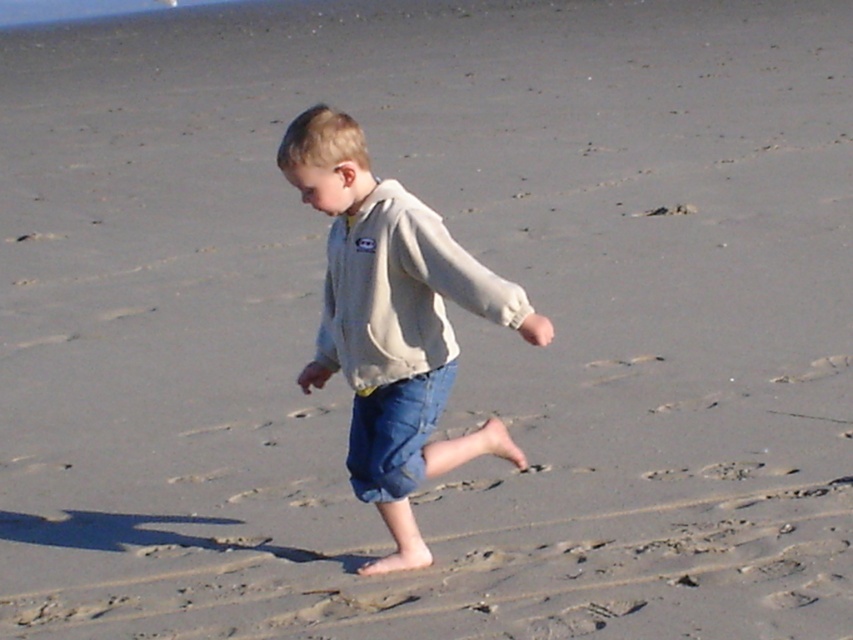
Question: Which point is farther from the camera taking this photo?

Choices:
 (A) (370, 317)
 (B) (292, 170)

Answer: (A)

Question: Which of the following is the closest to the observer?

Choices:
 (A) beige fleece sweatshirt at center
 (B) light beige fleece jacket at center

Answer: (B)

Question: Does light beige fleece jacket at center have a greater width compared to beige fleece sweatshirt at center?

Choices:
 (A) yes
 (B) no

Answer: (A)

Question: Is light beige fleece jacket at center positioned before beige fleece sweatshirt at center?

Choices:
 (A) yes
 (B) no

Answer: (A)

Question: Is light beige fleece jacket at center positioned at the back of beige fleece sweatshirt at center?

Choices:
 (A) yes
 (B) no

Answer: (B)